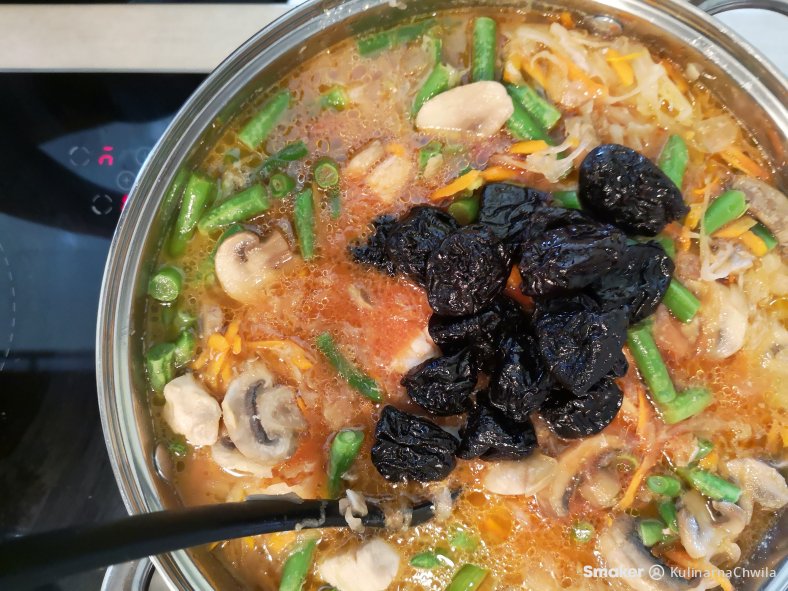
Where is `spoon handle`? This screenshot has height=591, width=788. spoon handle is located at coordinates (154, 535).